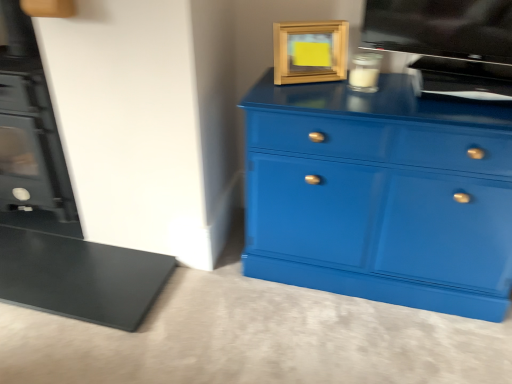
What are the coordinates of `wooden picture frame at upper center` in the screenshot? It's located at (310, 51).

The width and height of the screenshot is (512, 384). What do you see at coordinates (447, 41) in the screenshot? I see `flat screen tv at upper right, the 1th appliance when ordered from right to left` at bounding box center [447, 41].

Measure the distance between point (354, 61) and camera.

Point (354, 61) and camera are 1.53 meters apart from each other.

In order to click on wooden picture frame at upper center in this screenshot , I will do `click(310, 51)`.

Looking at this image, is wooden picture frame at upper center beside flat screen tv at upper right, placed as the 2th appliance when sorted from left to right?

No, wooden picture frame at upper center is not with flat screen tv at upper right, placed as the 2th appliance when sorted from left to right.

Looking at the image, does wooden picture frame at upper center seem bigger or smaller compared to flat screen tv at upper right, placed as the 2th appliance when sorted from left to right?

In the image, wooden picture frame at upper center appears to be smaller than flat screen tv at upper right, placed as the 2th appliance when sorted from left to right.

From a real-world perspective, is wooden picture frame at upper center physically below flat screen tv at upper right, the 1th appliance when ordered from right to left?

Yes, from a real-world perspective, wooden picture frame at upper center is beneath flat screen tv at upper right, the 1th appliance when ordered from right to left.

Starting from the wooden picture frame at upper center, which appliance is the 2nd one to the right? Please provide its 2D coordinates.

[(447, 41)]

From the image's perspective, is clear glass candle at upper center, placed as the first appliance when sorted from left to right, above or below glossy blue chest of drawers at center?

clear glass candle at upper center, placed as the first appliance when sorted from left to right, is above glossy blue chest of drawers at center.

How different are the orientations of clear glass candle at upper center, placed as the first appliance when sorted from left to right, and glossy blue chest of drawers at center in degrees?

The angular difference between clear glass candle at upper center, placed as the first appliance when sorted from left to right, and glossy blue chest of drawers at center is 2.04 degrees.

At what (x,y) coordinates should I click in order to perform the action: click on the chest of drawers that is below the clear glass candle at upper center, placed as the first appliance when sorted from left to right (from the image's perspective). Please return your answer as a coordinate pair (x, y). Looking at the image, I should click on (381, 194).

From a real-world perspective, which is physically below, clear glass candle at upper center, which appears as the second appliance when viewed from the right, or glossy blue chest of drawers at center?

From a 3D spatial view, glossy blue chest of drawers at center is below.

Is clear glass candle at upper center, which appears as the second appliance when viewed from the right, not close to flat screen tv at upper right, the 1th appliance when ordered from right to left?

No, clear glass candle at upper center, which appears as the second appliance when viewed from the right, is in close proximity to flat screen tv at upper right, the 1th appliance when ordered from right to left.

Can you confirm if clear glass candle at upper center, which appears as the second appliance when viewed from the right, is positioned to the right of flat screen tv at upper right, the 1th appliance when ordered from right to left?

No.

Is clear glass candle at upper center, placed as the first appliance when sorted from left to right, facing away from flat screen tv at upper right, placed as the 2th appliance when sorted from left to right?

Yes, flat screen tv at upper right, placed as the 2th appliance when sorted from left to right, is at the back of clear glass candle at upper center, placed as the first appliance when sorted from left to right.

Is clear glass candle at upper center, which appears as the second appliance when viewed from the right, wider than flat screen tv at upper right, placed as the 2th appliance when sorted from left to right?

Correct, the width of clear glass candle at upper center, which appears as the second appliance when viewed from the right, exceeds that of flat screen tv at upper right, placed as the 2th appliance when sorted from left to right.

Looking at the image, does wooden picture frame at upper center seem bigger or smaller compared to clear glass candle at upper center, which appears as the second appliance when viewed from the right?

Clearly, wooden picture frame at upper center is larger in size than clear glass candle at upper center, which appears as the second appliance when viewed from the right.

Is wooden picture frame at upper center facing away from clear glass candle at upper center, which appears as the second appliance when viewed from the right?

wooden picture frame at upper center does not have its back to clear glass candle at upper center, which appears as the second appliance when viewed from the right.

Between wooden picture frame at upper center and clear glass candle at upper center, placed as the first appliance when sorted from left to right, which one appears on the left side from the viewer's perspective?

wooden picture frame at upper center.

Is point (465, 302) closer or farther from the camera than point (5, 53)?

Point (465, 302) is closer to the camera than point (5, 53).

What's the angular difference between glossy blue chest of drawers at center and black matte fireplace at left's facing directions?

glossy blue chest of drawers at center and black matte fireplace at left are facing 1.16 degrees away from each other.

In terms of size, does glossy blue chest of drawers at center appear bigger or smaller than black matte fireplace at left?

Considering their sizes, glossy blue chest of drawers at center takes up more space than black matte fireplace at left.

Between glossy blue chest of drawers at center and black matte fireplace at left, which one appears on the left side from the viewer's perspective?

black matte fireplace at left is more to the left.

Is flat screen tv at upper right, the 1th appliance when ordered from right to left, turned away from glossy blue chest of drawers at center?

No, flat screen tv at upper right, the 1th appliance when ordered from right to left, is not facing the opposite direction of glossy blue chest of drawers at center.

How many degrees apart are the facing directions of flat screen tv at upper right, placed as the 2th appliance when sorted from left to right, and glossy blue chest of drawers at center?

The facing directions of flat screen tv at upper right, placed as the 2th appliance when sorted from left to right, and glossy blue chest of drawers at center are 15.2 degrees apart.

From the image's perspective, which object appears higher, flat screen tv at upper right, the 1th appliance when ordered from right to left, or glossy blue chest of drawers at center?

flat screen tv at upper right, the 1th appliance when ordered from right to left, appears higher in the image.

In terms of height, does flat screen tv at upper right, placed as the 2th appliance when sorted from left to right, look taller or shorter compared to glossy blue chest of drawers at center?

Clearly, flat screen tv at upper right, placed as the 2th appliance when sorted from left to right, is shorter compared to glossy blue chest of drawers at center.

Choose the correct answer: Is black matte fireplace at left inside flat screen tv at upper right, placed as the 2th appliance when sorted from left to right, or outside it?

black matte fireplace at left is not enclosed by flat screen tv at upper right, placed as the 2th appliance when sorted from left to right.

Does black matte fireplace at left have a smaller size compared to flat screen tv at upper right, placed as the 2th appliance when sorted from left to right?

No, black matte fireplace at left is not smaller than flat screen tv at upper right, placed as the 2th appliance when sorted from left to right.

Considering the sizes of objects black matte fireplace at left and flat screen tv at upper right, placed as the 2th appliance when sorted from left to right, in the image provided, who is wider, black matte fireplace at left or flat screen tv at upper right, placed as the 2th appliance when sorted from left to right,?

With larger width is black matte fireplace at left.

Which is more to the right, black matte fireplace at left or flat screen tv at upper right, the 1th appliance when ordered from right to left?

From the viewer's perspective, flat screen tv at upper right, the 1th appliance when ordered from right to left, appears more on the right side.

Where is `picture frame that appears below the flat screen tv at upper right, placed as the 2th appliance when sorted from left to right (from the image's perspective)`? The height and width of the screenshot is (384, 512). picture frame that appears below the flat screen tv at upper right, placed as the 2th appliance when sorted from left to right (from the image's perspective) is located at coordinates (310, 51).

Image resolution: width=512 pixels, height=384 pixels. What are the coordinates of `the 1st appliance located above the glossy blue chest of drawers at center (from a real-world perspective)` in the screenshot? It's located at [365, 72].

From the image, which object appears to be nearer to wooden picture frame at upper center, flat screen tv at upper right, placed as the 2th appliance when sorted from left to right, or clear glass candle at upper center, placed as the first appliance when sorted from left to right?

Among the two, clear glass candle at upper center, placed as the first appliance when sorted from left to right, is located nearer to wooden picture frame at upper center.

From the image, which object appears to be farther from flat screen tv at upper right, placed as the 2th appliance when sorted from left to right, wooden picture frame at upper center or clear glass candle at upper center, placed as the first appliance when sorted from left to right?

Based on the image, wooden picture frame at upper center appears to be further to flat screen tv at upper right, placed as the 2th appliance when sorted from left to right.

From the image, which object appears to be nearer to flat screen tv at upper right, placed as the 2th appliance when sorted from left to right, glossy blue chest of drawers at center or wooden picture frame at upper center?

Based on the image, wooden picture frame at upper center appears to be nearer to flat screen tv at upper right, placed as the 2th appliance when sorted from left to right.

Considering their positions, is flat screen tv at upper right, the 1th appliance when ordered from right to left, positioned closer to glossy blue chest of drawers at center than wooden picture frame at upper center?

Among the two, flat screen tv at upper right, the 1th appliance when ordered from right to left, is located nearer to glossy blue chest of drawers at center.

When comparing their distances from glossy blue chest of drawers at center, does black matte fireplace at left or clear glass candle at upper center, which appears as the second appliance when viewed from the right, seem further?

black matte fireplace at left is further to glossy blue chest of drawers at center.

From the image, which object appears to be nearer to clear glass candle at upper center, placed as the first appliance when sorted from left to right, black matte fireplace at left or flat screen tv at upper right, the 1th appliance when ordered from right to left?

Among the two, flat screen tv at upper right, the 1th appliance when ordered from right to left, is located nearer to clear glass candle at upper center, placed as the first appliance when sorted from left to right.

Based on their spatial positions, is clear glass candle at upper center, which appears as the second appliance when viewed from the right, or wooden picture frame at upper center closer to black matte fireplace at left?

wooden picture frame at upper center.

Looking at the image, which one is located closer to flat screen tv at upper right, the 1th appliance when ordered from right to left, wooden picture frame at upper center or black matte fireplace at left?

wooden picture frame at upper center is positioned closer to the anchor flat screen tv at upper right, the 1th appliance when ordered from right to left.

Where is `appliance that lies between flat screen tv at upper right, placed as the 2th appliance when sorted from left to right, and glossy blue chest of drawers at center from top to bottom`? This screenshot has width=512, height=384. appliance that lies between flat screen tv at upper right, placed as the 2th appliance when sorted from left to right, and glossy blue chest of drawers at center from top to bottom is located at coordinates (365, 72).

What are the coordinates of `appliance located between wooden picture frame at upper center and flat screen tv at upper right, placed as the 2th appliance when sorted from left to right, in the left-right direction` in the screenshot? It's located at (365, 72).

This screenshot has width=512, height=384. What are the coordinates of `picture frame between black matte fireplace at left and clear glass candle at upper center, which appears as the second appliance when viewed from the right, in the horizontal direction` in the screenshot? It's located at (310, 51).

The width and height of the screenshot is (512, 384). Identify the location of picture frame situated between black matte fireplace at left and glossy blue chest of drawers at center from left to right. (310, 51).